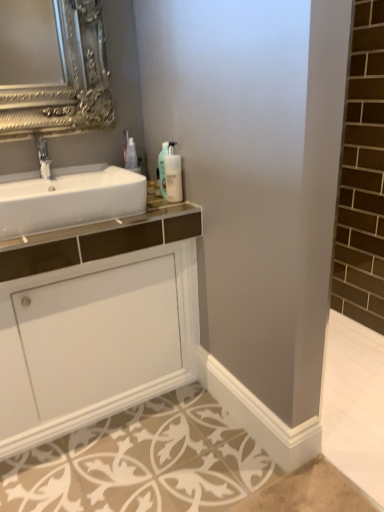
The height and width of the screenshot is (512, 384). I want to click on blank area beneath white painted wood baseboard at lower center (from a real-world perspective), so click(x=233, y=421).